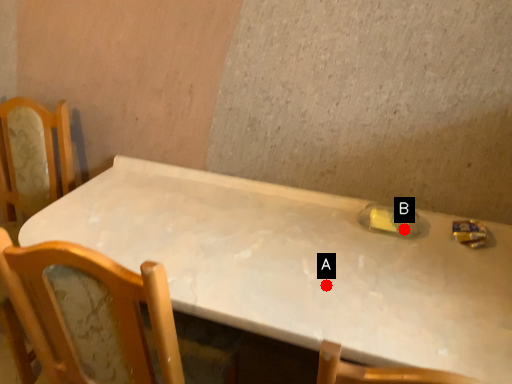
Question: Two points are circled on the image, labeled by A and B beside each circle. Which point is farther from the camera taking this photo?

Choices:
 (A) A is further
 (B) B is further

Answer: (B)